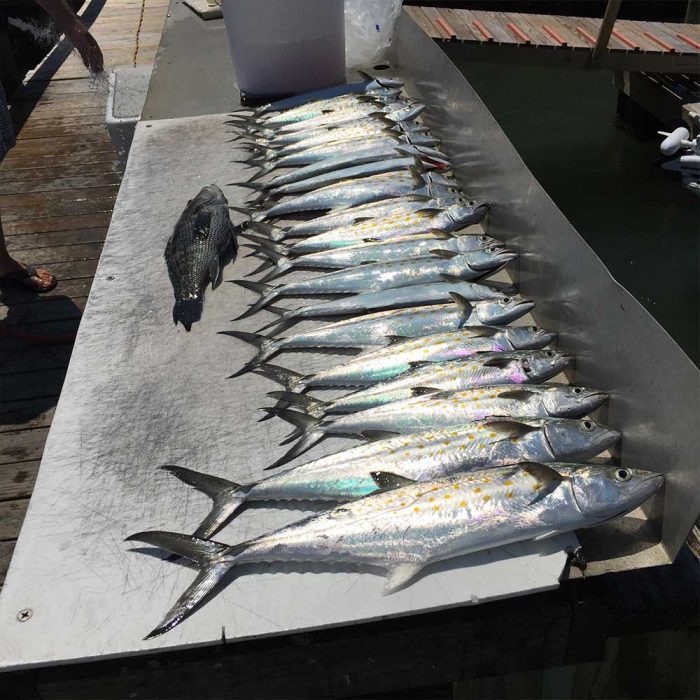
Locate an element on the screen. This screenshot has width=700, height=700. bucket is located at coordinates (281, 33).